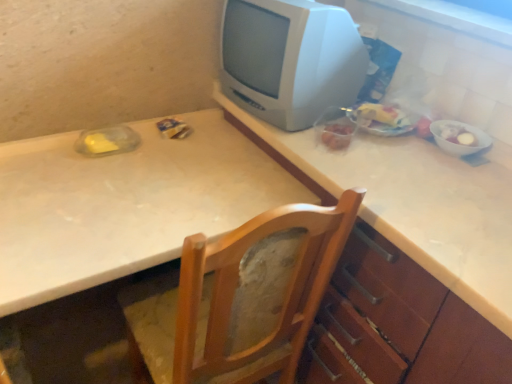
Question: Is wooden chair at center facing towards translucent plastic bag of food at right, positioned as the 2th food in right-to-left order?

Choices:
 (A) yes
 (B) no

Answer: (B)

Question: Can you confirm if wooden chair at center is wider than translucent plastic bag of food at right, positioned as the 2th food in right-to-left order?

Choices:
 (A) no
 (B) yes

Answer: (B)

Question: Is wooden chair at center looking in the opposite direction of translucent plastic bag of food at right, arranged as the first food when viewed from the left?

Choices:
 (A) yes
 (B) no

Answer: (B)

Question: Is wooden chair at center not within translucent plastic bag of food at right, positioned as the 2th food in right-to-left order?

Choices:
 (A) no
 (B) yes

Answer: (B)

Question: Considering the relative sizes of wooden chair at center and translucent plastic bag of food at right, positioned as the 2th food in right-to-left order, in the image provided, is wooden chair at center shorter than translucent plastic bag of food at right, positioned as the 2th food in right-to-left order,?

Choices:
 (A) no
 (B) yes

Answer: (A)

Question: Does wooden chair at center have a smaller size compared to translucent plastic bag of food at right, positioned as the 2th food in right-to-left order?

Choices:
 (A) yes
 (B) no

Answer: (B)

Question: Is white plastic television at upper right shorter than white glossy bowl at right, which is the 2th food in left-to-right order?

Choices:
 (A) no
 (B) yes

Answer: (A)

Question: Is white plastic television at upper right positioned behind white glossy bowl at right, arranged as the first food when viewed from the right?

Choices:
 (A) no
 (B) yes

Answer: (A)

Question: Does white plastic television at upper right turn towards white glossy bowl at right, arranged as the first food when viewed from the right?

Choices:
 (A) yes
 (B) no

Answer: (B)

Question: Can you confirm if white plastic television at upper right is thinner than white glossy bowl at right, which is the 2th food in left-to-right order?

Choices:
 (A) no
 (B) yes

Answer: (A)

Question: From a real-world perspective, does white plastic television at upper right stand above white glossy bowl at right, which is the 2th food in left-to-right order?

Choices:
 (A) no
 (B) yes

Answer: (B)

Question: Can we say white plastic television at upper right lies outside white glossy bowl at right, arranged as the first food when viewed from the right?

Choices:
 (A) no
 (B) yes

Answer: (B)

Question: Is white glossy window sill at upper right aimed at wooden chair at center?

Choices:
 (A) yes
 (B) no

Answer: (B)